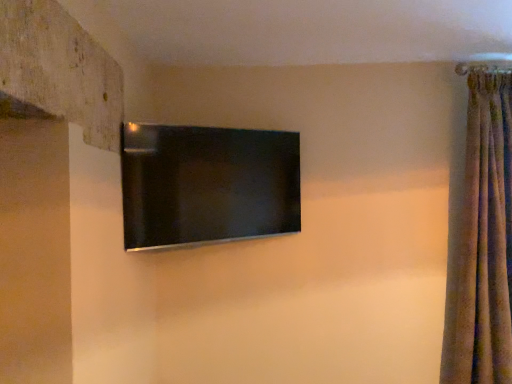
Question: Is matte black tv at center inside or outside of brown velvet curtain at right?

Choices:
 (A) inside
 (B) outside

Answer: (B)

Question: From the image's perspective, is matte black tv at center above or below brown velvet curtain at right?

Choices:
 (A) below
 (B) above

Answer: (B)

Question: Is matte black tv at center in front of or behind brown velvet curtain at right in the image?

Choices:
 (A) behind
 (B) front

Answer: (B)

Question: Is brown velvet curtain at right bigger or smaller than matte black tv at center?

Choices:
 (A) big
 (B) small

Answer: (A)

Question: In terms of width, does brown velvet curtain at right look wider or thinner when compared to matte black tv at center?

Choices:
 (A) thin
 (B) wide

Answer: (B)

Question: From a real-world perspective, is brown velvet curtain at right positioned above or below matte black tv at center?

Choices:
 (A) below
 (B) above

Answer: (A)

Question: From the image's perspective, is brown velvet curtain at right above or below matte black tv at center?

Choices:
 (A) below
 (B) above

Answer: (A)